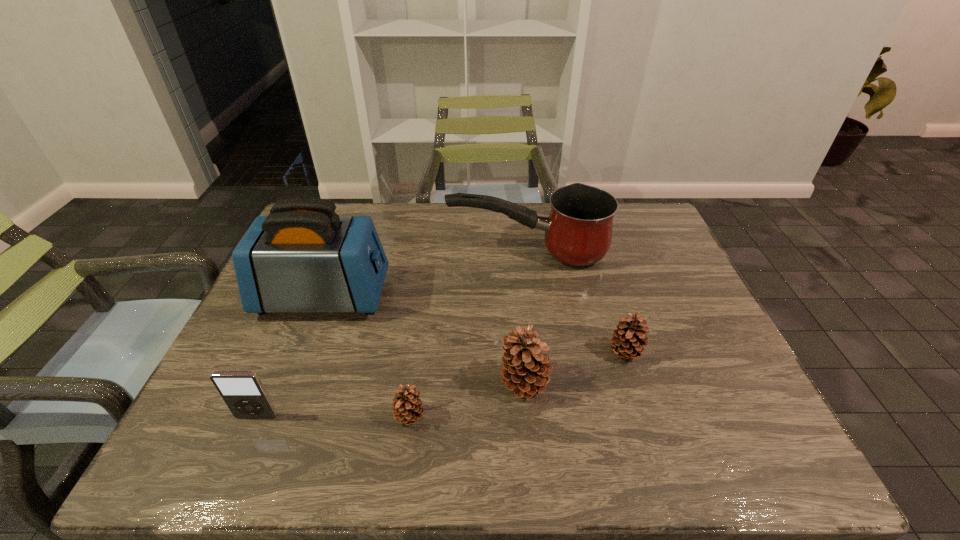
Where is `free space that satisfies the following two spatial constraints: 1. on the front-facing side of the tallest object; 2. on the right side of the second tallest pinecone`? The image size is (960, 540). free space that satisfies the following two spatial constraints: 1. on the front-facing side of the tallest object; 2. on the right side of the second tallest pinecone is located at coordinates (302, 353).

This screenshot has height=540, width=960. I want to click on vacant space that satisfies the following two spatial constraints: 1. on the front-facing side of the tallest object; 2. on the front-facing side of the iPod, so click(x=277, y=416).

This screenshot has width=960, height=540. What are the coordinates of `vacant point that satisfies the following two spatial constraints: 1. on the handle side of the saucepan; 2. on the front side of the shortest pinecone` in the screenshot? It's located at (549, 417).

Locate an element on the screen. The height and width of the screenshot is (540, 960). vacant area in the image that satisfies the following two spatial constraints: 1. on the front-facing side of the toaster; 2. on the left side of the second shortest pinecone is located at coordinates (302, 353).

Locate an element on the screen. The image size is (960, 540). free space that satisfies the following two spatial constraints: 1. on the front-facing side of the tallest object; 2. on the left side of the second pinecone from right to left is located at coordinates (291, 383).